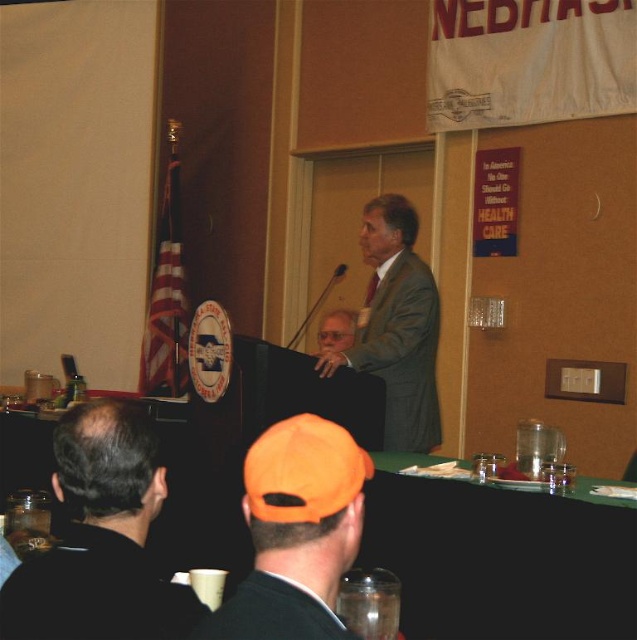
You are attending the event and want to place a small notebook on the green fabric table at lower center. However, you notice the orange fabric cap at lower center is already there. Can the notebook fit on the table without being blocked by the cap?

The green fabric table at lower center is much taller than the orange fabric cap at lower center, so the notebook can be placed on the table above or beside the cap without obstruction.

You are sitting in the audience at this event and notice the green fabric table at lower center and the black fabric jacket at lower left. Which object is positioned more to the right side of the scene?

The green fabric table at lower center is positioned more to the right side of the scene compared to the black fabric jacket at lower left.

You are a photographer positioned at the camera. You want to take a closeup shot of the orange fabric cap at lower center. Is it within your camera range if your camera can focus on objects within 1 meter?

The orange fabric cap at lower center is 1.00 meters away from camera, so yes, it is within the camera range since it is exactly at the 1 meter distance.